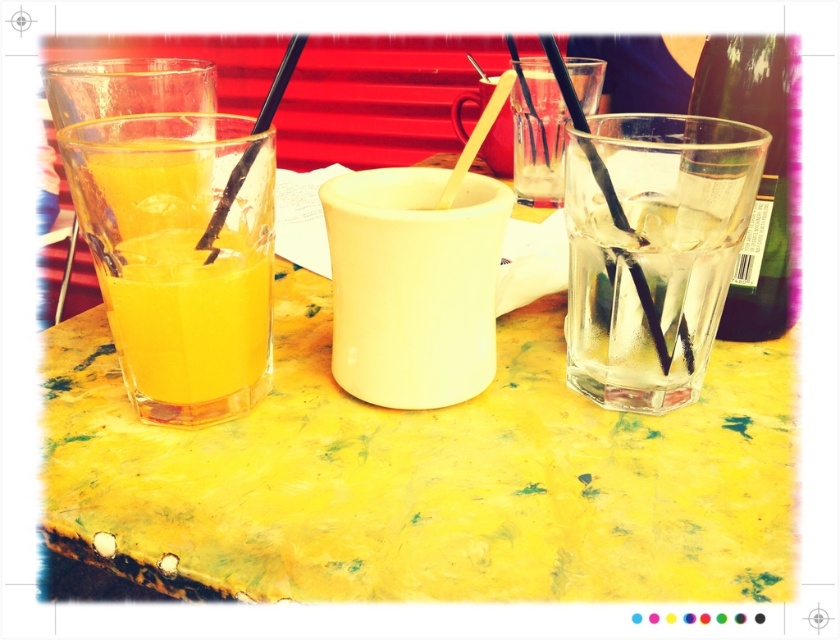
You are a customer at the outdoor dining area and want to reach for the white matte cup at center and the transparent plastic straw at left. Which one is positioned lower from your viewpoint?

The white matte cup at center is located below the transparent plastic straw at left, so it is positioned lower from your viewpoint.

You are a customer at the outdoor dining table and want to reach both the point at [373,317] and the point at [302,45]. Which point will you reach first if you extend your hand straight out?

You will reach the point at [373,317] first because it is closer to you than the point at [302,45].

You are a server at the outdoor cafe and need to place a new order of drinks on the table. The table has limited space. Which item, the green glass bottle at right or the transparent plastic straw at left, takes up more horizontal space?

The green glass bottle at right has a greater width than the transparent plastic straw at left, so it occupies more horizontal space.